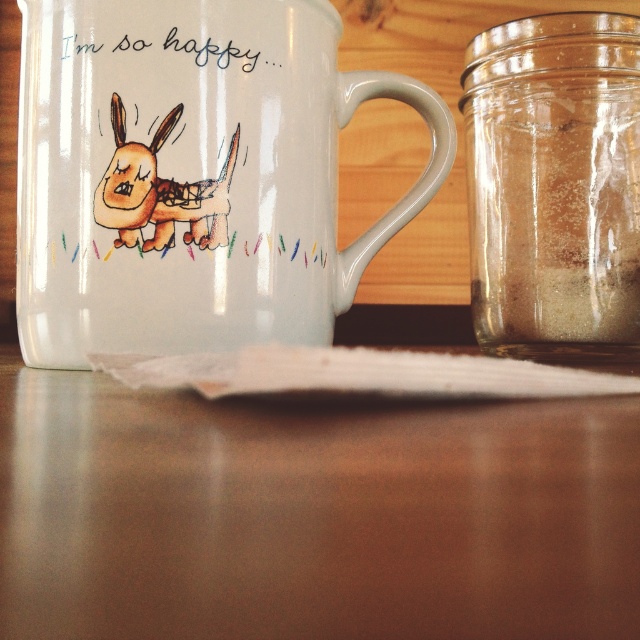
Question: Does white glossy mug at upper center appear over transparent glass jar at right?

Choices:
 (A) no
 (B) yes

Answer: (B)

Question: Is matte brown table at center above transparent glass jar at right?

Choices:
 (A) yes
 (B) no

Answer: (B)

Question: Which point appears farthest from the camera in this image?

Choices:
 (A) (8, 346)
 (B) (602, 321)

Answer: (A)

Question: Does matte brown table at center appear over white glossy mug at upper center?

Choices:
 (A) no
 (B) yes

Answer: (A)

Question: Which of the following is the farthest from the observer?

Choices:
 (A) (548, 332)
 (B) (508, 483)
 (C) (22, 212)

Answer: (A)

Question: Which of the following is the closest to the observer?

Choices:
 (A) white glossy mug at upper center
 (B) transparent glass jar at right
 (C) matte brown table at center

Answer: (C)